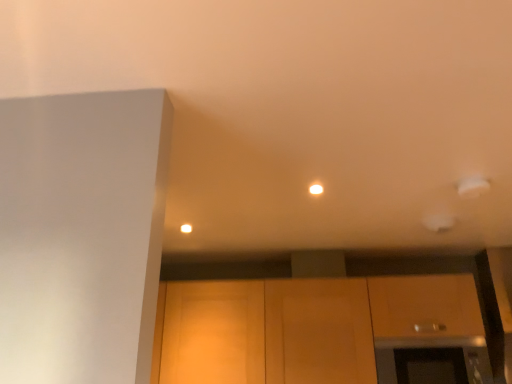
At what (x,y) coordinates should I click in order to perform the action: click on matte wood cabinetry at lower center. Please return your answer as a coordinate pair (x, y). Looking at the image, I should click on (321, 330).

This screenshot has width=512, height=384. What do you see at coordinates (321, 330) in the screenshot? I see `matte wood cabinetry at lower center` at bounding box center [321, 330].

The height and width of the screenshot is (384, 512). Describe the element at coordinates (433, 359) in the screenshot. I see `black glass oven at lower right` at that location.

The image size is (512, 384). What are the coordinates of `black glass oven at lower right` in the screenshot? It's located at (433, 359).

Identify the location of matte wood cabinetry at lower center. (321, 330).

Is black glass oven at lower right to the right of matte wood cabinetry at lower center from the viewer's perspective?

Yes.

Is black glass oven at lower right further to camera compared to matte wood cabinetry at lower center?

No, it is not.

Between point (460, 343) and point (207, 333), which one is positioned in front?

The point (460, 343) is closer.

From the image's perspective, who appears lower, black glass oven at lower right or matte wood cabinetry at lower center?

black glass oven at lower right, from the image's perspective.

From a real-world perspective, who is located higher, black glass oven at lower right or matte wood cabinetry at lower center?

From a 3D spatial view, matte wood cabinetry at lower center is above.

Considering the relative sizes of black glass oven at lower right and matte wood cabinetry at lower center in the image provided, is black glass oven at lower right thinner than matte wood cabinetry at lower center?

Correct, the width of black glass oven at lower right is less than that of matte wood cabinetry at lower center.

Between black glass oven at lower right and matte wood cabinetry at lower center, which one has more height?

With more height is matte wood cabinetry at lower center.

Can you confirm if black glass oven at lower right is smaller than matte wood cabinetry at lower center?

Indeed, black glass oven at lower right has a smaller size compared to matte wood cabinetry at lower center.

Is black glass oven at lower right spatially inside matte wood cabinetry at lower center, or outside of it?

black glass oven at lower right can be found inside matte wood cabinetry at lower center.

Would you consider black glass oven at lower right to be distant from matte wood cabinetry at lower center?

No, there isn't a large distance between black glass oven at lower right and matte wood cabinetry at lower center.

From the picture: Is black glass oven at lower right looking in the opposite direction of matte wood cabinetry at lower center?

Yes, black glass oven at lower right's orientation is away from matte wood cabinetry at lower center.

How different are the orientations of black glass oven at lower right and matte wood cabinetry at lower center in degrees?

The facing directions of black glass oven at lower right and matte wood cabinetry at lower center are 0.0939 degrees apart.

Where is `cabinetry above the black glass oven at lower right (from the image's perspective)`? This screenshot has height=384, width=512. cabinetry above the black glass oven at lower right (from the image's perspective) is located at coordinates (321, 330).

Is matte wood cabinetry at lower center to the left of black glass oven at lower right from the viewer's perspective?

Yes.

Does matte wood cabinetry at lower center lie behind black glass oven at lower right?

Yes, it is.

From the picture: Which is nearer, (475, 338) or (383, 380)?

Point (383, 380)

From the image's perspective, which is below, matte wood cabinetry at lower center or black glass oven at lower right?

black glass oven at lower right appears lower in the image.

From a real-world perspective, which is physically above, matte wood cabinetry at lower center or black glass oven at lower right?

matte wood cabinetry at lower center, from a real-world perspective.

Does matte wood cabinetry at lower center have a lesser width compared to black glass oven at lower right?

Incorrect, the width of matte wood cabinetry at lower center is not less than that of black glass oven at lower right.

Considering the relative sizes of matte wood cabinetry at lower center and black glass oven at lower right in the image provided, is matte wood cabinetry at lower center shorter than black glass oven at lower right?

No, matte wood cabinetry at lower center is not shorter than black glass oven at lower right.

Considering the sizes of objects matte wood cabinetry at lower center and black glass oven at lower right in the image provided, who is bigger, matte wood cabinetry at lower center or black glass oven at lower right?

With larger size is matte wood cabinetry at lower center.

Do you think matte wood cabinetry at lower center is within black glass oven at lower right, or outside of it?

matte wood cabinetry at lower center is not enclosed by black glass oven at lower right.

Is matte wood cabinetry at lower center placed right next to black glass oven at lower right?

No, matte wood cabinetry at lower center is not making contact with black glass oven at lower right.

Is matte wood cabinetry at lower center oriented away from black glass oven at lower right?

Yes, black glass oven at lower right is at the back of matte wood cabinetry at lower center.

How many degrees apart are the facing directions of matte wood cabinetry at lower center and black glass oven at lower right?

matte wood cabinetry at lower center and black glass oven at lower right are facing 0.0939 degrees away from each other.

In the image, there is a matte wood cabinetry at lower center. At what (x,y) coordinates should I click in order to perform the action: click on oven below it (from the image's perspective). Please return your answer as a coordinate pair (x, y). Looking at the image, I should click on (433, 359).

Where is `oven below the matte wood cabinetry at lower center (from the image's perspective)`? oven below the matte wood cabinetry at lower center (from the image's perspective) is located at coordinates (433, 359).

The height and width of the screenshot is (384, 512). I want to click on cabinetry above the black glass oven at lower right (from the image's perspective), so click(321, 330).